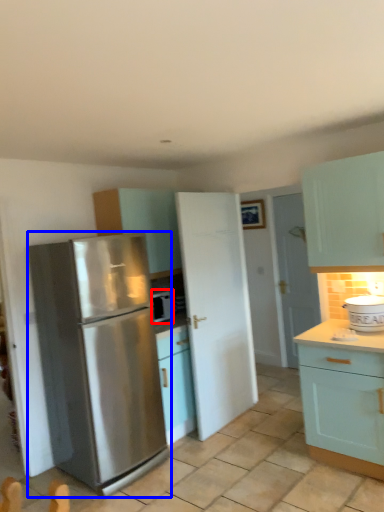
Question: Which of the following is the farthest to the observer, appliance (highlighted by a red box) or refrigerator (highlighted by a blue box)?

Choices:
 (A) appliance
 (B) refrigerator

Answer: (A)